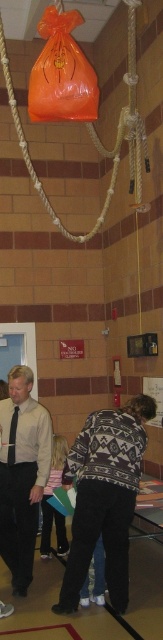
Question: From the image, what is the correct spatial relationship of knit sweater at center in relation to matte black shirt at center?

Choices:
 (A) left
 (B) right

Answer: (B)

Question: Can you confirm if knit sweater at center is smaller than matte black shirt at center?

Choices:
 (A) yes
 (B) no

Answer: (B)

Question: Does knit sweater at center appear over orange plastic bag at upper center?

Choices:
 (A) yes
 (B) no

Answer: (B)

Question: Estimate the real-world distances between objects in this image. Which object is closer to the orange plastic bag at upper center?

Choices:
 (A) matte black shirt at center
 (B) knit sweater at center

Answer: (B)

Question: Which object is farther from the camera taking this photo?

Choices:
 (A) knit sweater at center
 (B) matte black shirt at center

Answer: (B)

Question: Which of the following is the farthest from the observer?

Choices:
 (A) orange plastic bag at upper center
 (B) matte black shirt at center

Answer: (B)